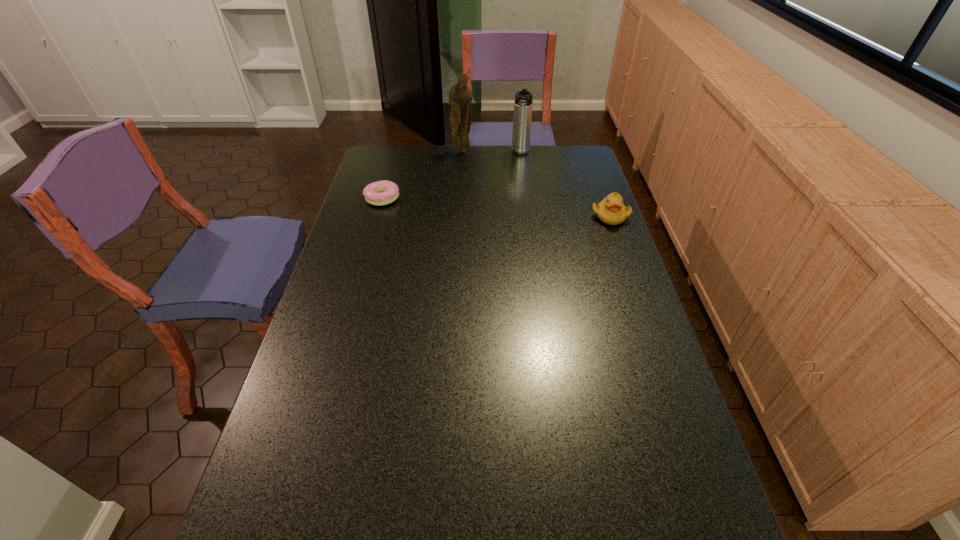
Locate an element on the screen. This screenshot has height=540, width=960. free area in between the second object from left to right and the rightmost object is located at coordinates tap(536, 184).

Locate an element on the screen. This screenshot has width=960, height=540. unoccupied area between the thermos bottle and the tallest object is located at coordinates (492, 152).

The height and width of the screenshot is (540, 960). Identify the location of empty space that is in between the thermos bottle and the figurine. (492, 152).

You are a GUI agent. You are given a task and a screenshot of the screen. Output one action in this format:
    pyautogui.click(x=<x>, y=<y>)
    Task: Click on the free space between the third shortest object and the doughnut
    
    Given the screenshot: What is the action you would take?
    pyautogui.click(x=451, y=176)

Find the location of `free point between the second shortest object and the leftmost object`. free point between the second shortest object and the leftmost object is located at coordinates (496, 207).

Locate an element on the screen. object that is the closest to the rightmost object is located at coordinates (522, 118).

The width and height of the screenshot is (960, 540). Identify the location of object that is the closest one to the figurine. (522, 118).

Image resolution: width=960 pixels, height=540 pixels. What are the coordinates of `free space in the image that satisfies the following two spatial constraints: 1. on the back side of the shortest object; 2. on the left side of the figurine` in the screenshot? It's located at (396, 151).

Identify the location of free space that satisfies the following two spatial constraints: 1. on the back side of the doughnut; 2. on the right side of the thermos bottle. tap(395, 153).